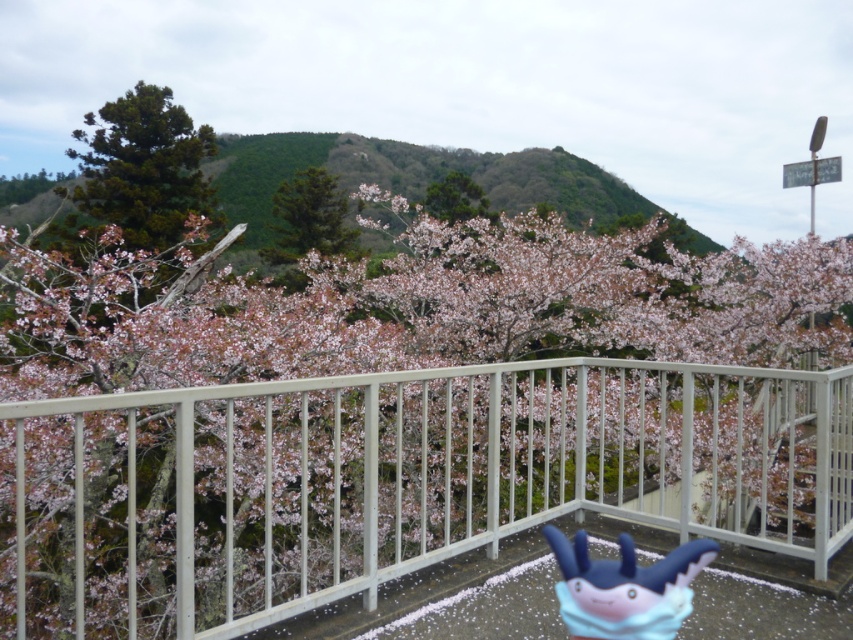
Question: Can you confirm if green needle-like at upper left is thinner than green matte tree at center?

Choices:
 (A) no
 (B) yes

Answer: (B)

Question: Which point appears farthest from the camera in this image?

Choices:
 (A) (585, 636)
 (B) (552, 513)
 (C) (463, 202)
 (D) (339, 205)

Answer: (D)

Question: Can you confirm if blue rubber toy at center is bigger than green matte tree at upper center?

Choices:
 (A) yes
 (B) no

Answer: (B)

Question: Which point is farther to the camera?

Choices:
 (A) (668, 554)
 (B) (310, 243)

Answer: (B)

Question: Which point appears farthest from the camera in this image?

Choices:
 (A) (265, 499)
 (B) (341, 204)
 (C) (437, 204)
 (D) (656, 609)

Answer: (B)

Question: Is white metal railing at center below green matte tree at upper center?

Choices:
 (A) yes
 (B) no

Answer: (A)